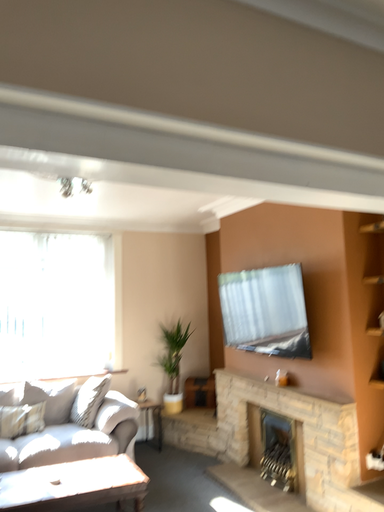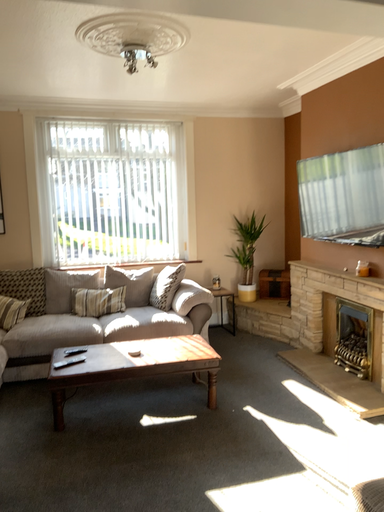
Question: Which way did the camera rotate in the video?

Choices:
 (A) rotated upward
 (B) rotated downward

Answer: (B)